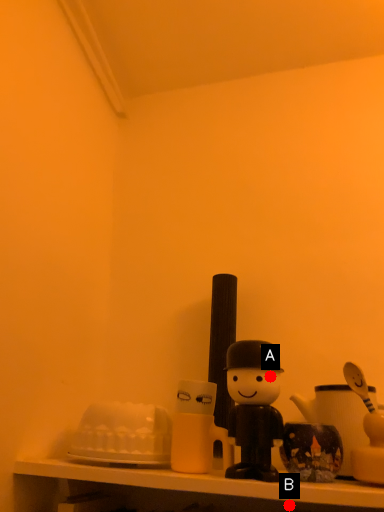
Question: Two points are circled on the image, labeled by A and B beside each circle. Which point is farther from the camera taking this photo?

Choices:
 (A) A is further
 (B) B is further

Answer: (A)